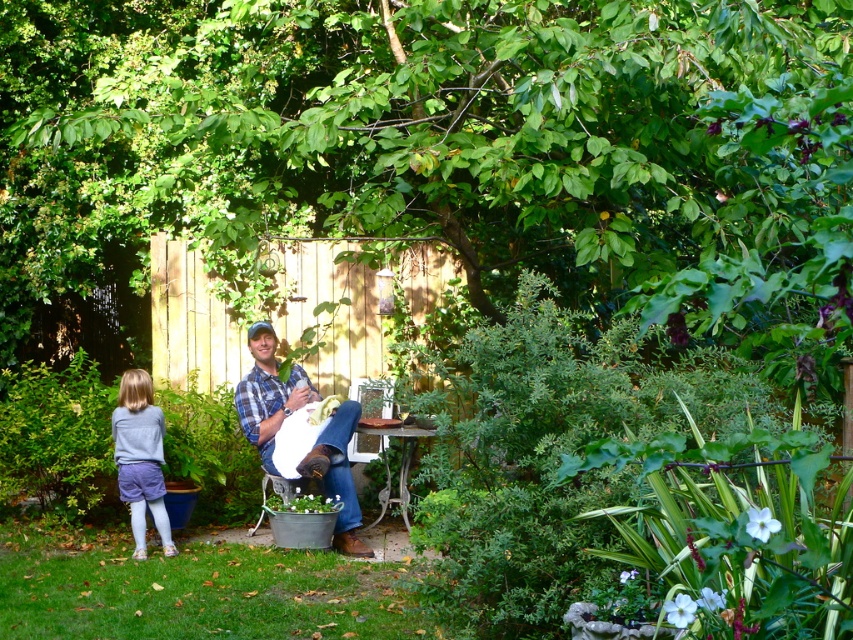
Between plaid shirt at center and metallic silver table at center, which one has less height?

Standing shorter between the two is metallic silver table at center.

Where is `plaid shirt at center`? plaid shirt at center is located at coordinates (268, 392).

Is the position of light gray cotton sweater at lower left more distant than that of metallic silver table at center?

No, it is in front of metallic silver table at center.

Can you confirm if light gray cotton sweater at lower left is shorter than metallic silver table at center?

In fact, light gray cotton sweater at lower left may be taller than metallic silver table at center.

At what (x,y) coordinates should I click in order to perform the action: click on light gray cotton sweater at lower left. Please return your answer as a coordinate pair (x, y). Looking at the image, I should click on (140, 458).

Identify the location of light gray cotton sweater at lower left. (140, 458).

Does plaid shirt at center have a greater height compared to light gray cotton sweater at lower left?

No.

Which is in front, point (346, 545) or point (143, 512)?

Point (346, 545)

This screenshot has width=853, height=640. Describe the element at coordinates (268, 392) in the screenshot. I see `plaid shirt at center` at that location.

You are a GUI agent. You are given a task and a screenshot of the screen. Output one action in this format:
    pyautogui.click(x=<x>, y=<y>)
    Task: Click on the plaid shirt at center
    
    Given the screenshot: What is the action you would take?
    pyautogui.click(x=268, y=392)